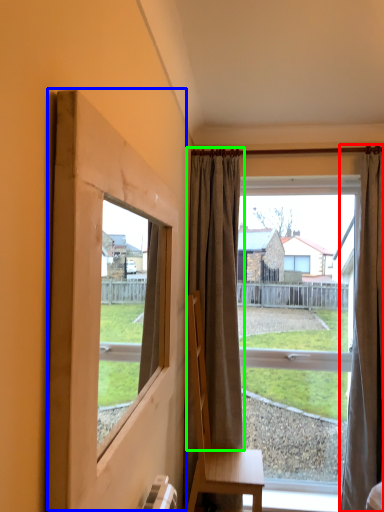
Question: Which object is the closest to the curtain (highlighted by a red box)? Choose among these: window frame (highlighted by a blue box) or curtain (highlighted by a green box).

Choices:
 (A) window frame
 (B) curtain

Answer: (B)